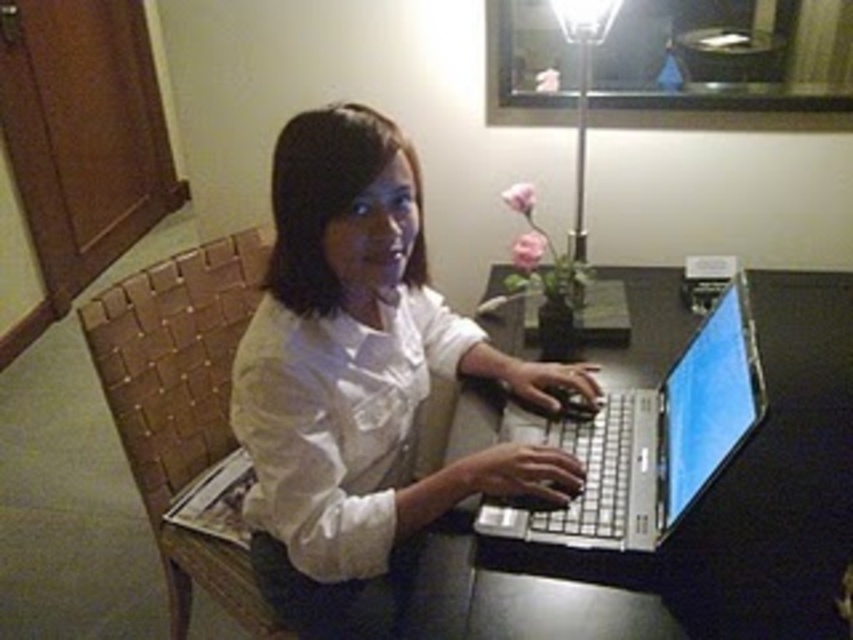
Between white matte shirt at center and metallic silver lamp at upper center, which one is positioned lower?

white matte shirt at center is below.

This screenshot has width=853, height=640. Find the location of `white matte shirt at center`. white matte shirt at center is located at coordinates (364, 358).

Is point (271, 406) closer to viewer compared to point (577, 264)?

Yes, point (271, 406) is in front of point (577, 264).

Find the location of a particular element. white matte shirt at center is located at coordinates (364, 358).

Looking at this image, can you confirm if silver metallic laptop at center is smaller than metallic silver lamp at upper center?

Indeed, silver metallic laptop at center has a smaller size compared to metallic silver lamp at upper center.

Can you confirm if silver metallic laptop at center is positioned below metallic silver lamp at upper center?

Yes.

What do you see at coordinates (646, 442) in the screenshot? The height and width of the screenshot is (640, 853). I see `silver metallic laptop at center` at bounding box center [646, 442].

Locate an element on the screen. This screenshot has width=853, height=640. silver metallic laptop at center is located at coordinates (646, 442).

Can you confirm if white matte shirt at center is shorter than silver metallic laptop at center?

→ Incorrect, white matte shirt at center's height does not fall short of silver metallic laptop at center's.

Describe the element at coordinates (364, 358) in the screenshot. I see `white matte shirt at center` at that location.

This screenshot has width=853, height=640. What are the coordinates of `white matte shirt at center` in the screenshot? It's located at (364, 358).

Locate an element on the screen. The image size is (853, 640). white matte shirt at center is located at coordinates tap(364, 358).